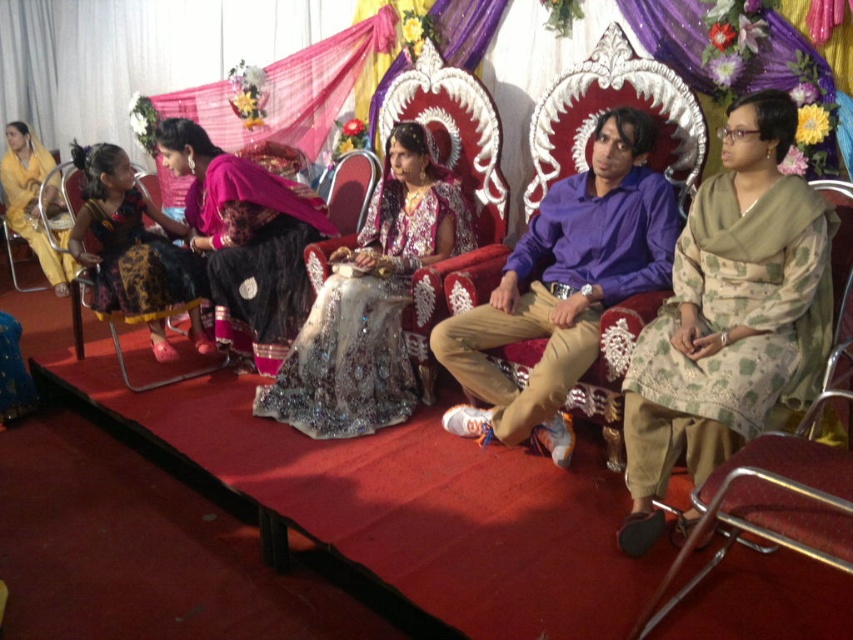
Question: Among these points, which one is farthest from the camera?

Choices:
 (A) (106, 220)
 (B) (595, 173)
 (C) (415, 220)

Answer: (A)

Question: Is green floral dress at center positioned at the back of shiny pink fabric at left?

Choices:
 (A) no
 (B) yes

Answer: (A)

Question: Can you confirm if green floral dress at center is positioned below shiny black dress at left?

Choices:
 (A) no
 (B) yes

Answer: (B)

Question: Where is green floral dress at center located in relation to matte black dress at left in the image?

Choices:
 (A) left
 (B) right

Answer: (B)

Question: Which of the following is the farthest from the observer?

Choices:
 (A) matte black dress at left
 (B) sparkling silver dress at center
 (C) purple cotton shirt at center

Answer: (A)

Question: Among these points, which one is nearest to the camera?

Choices:
 (A) (201, 272)
 (B) (415, 189)
 (C) (666, 381)
 (D) (167, 257)

Answer: (C)